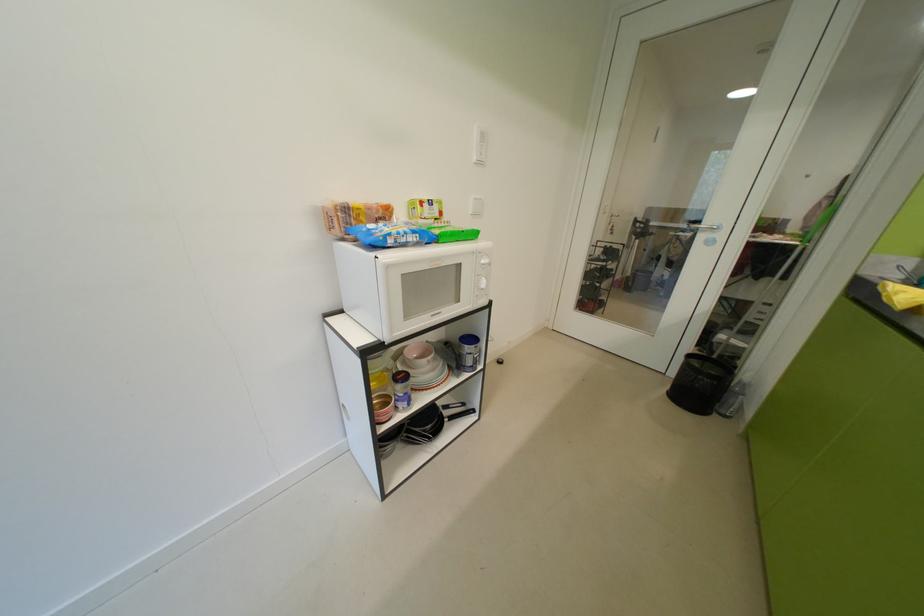
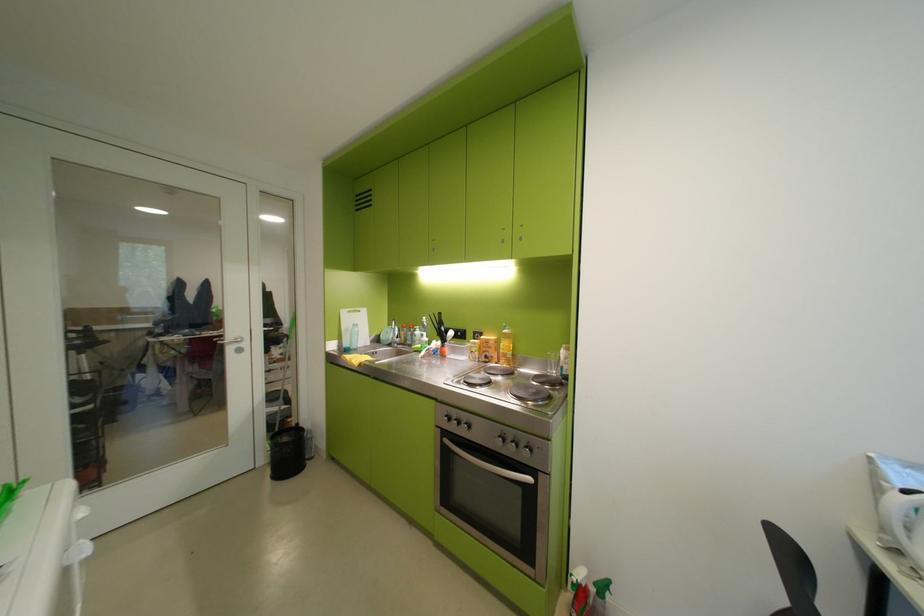
Locate, in the second image, the point that corresponds to [711,387] in the first image.

(299, 453)